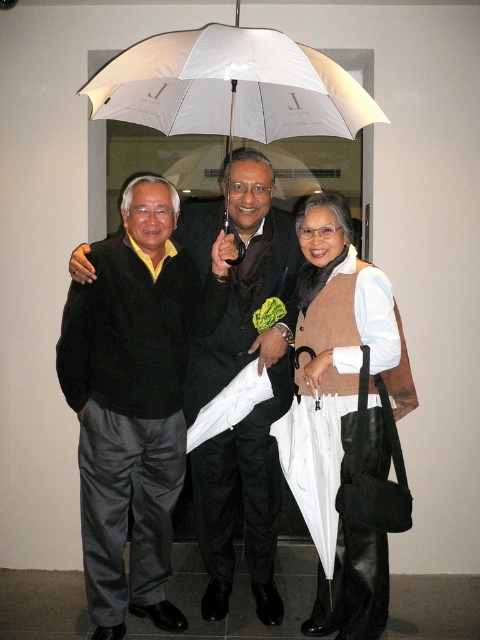
You are a photographer trying to arrange two subjects in a photo shoot. You have a black sweater at center and a matte brown vest at center. Which subject should you position closer to the camera to ensure both appear proportionally sized in the final image?

Since the black sweater at center is much taller than the matte brown vest at center, you should position the matte brown vest at center closer to the camera to balance their sizes in the photo.

You are standing in the room and want to find the matte brown vest at center. According to the scene description, where should you look relative to the glass door or window?

The matte brown vest at center is located at point (x=348, y=332), which means it is positioned centrally in the image, so you should look towards the center area near the glass door or window where the individuals are standing.

You are standing in the room where the photograph was taken. There is a point marked at coordinates (134, 397). What object is located at this point?

The point at coordinates (134, 397) marks the location of the black sweater at center.